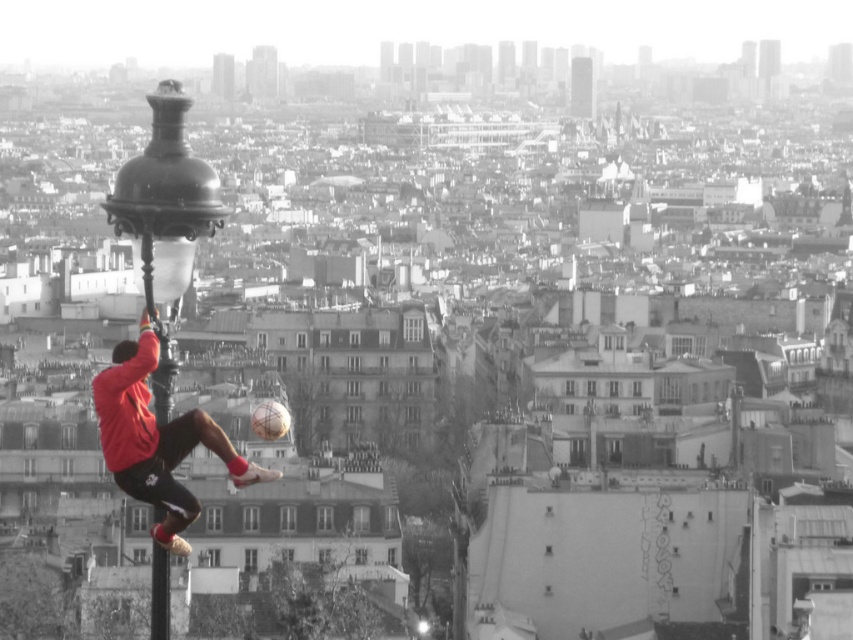
Question: Considering the real-world distances, which object is closest to the polished brass lamp post at left?

Choices:
 (A) red matte soccer player at center
 (B) polished metal pole at left

Answer: (B)

Question: Which point is farther from the camera taking this photo?

Choices:
 (A) (206, 177)
 (B) (207, 444)

Answer: (A)

Question: Is polished brass lamp post at left below red matte soccer player at center?

Choices:
 (A) no
 (B) yes

Answer: (B)

Question: Observing the image, what is the correct spatial positioning of polished brass lamp post at left in reference to red matte soccer player at center?

Choices:
 (A) below
 (B) above

Answer: (A)

Question: Does polished brass lamp post at left have a smaller size compared to polished metal pole at left?

Choices:
 (A) no
 (B) yes

Answer: (A)

Question: Which object appears closest to the camera in this image?

Choices:
 (A) polished metal pole at left
 (B) polished brass lamp post at left

Answer: (B)